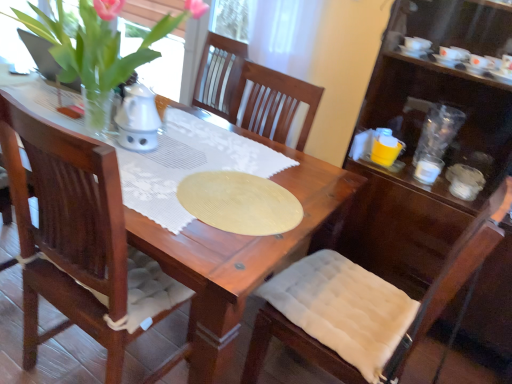
Question: Is transparent plastic cups at right, positioned as the 1th tableware in top-to-bottom order, to the left or to the right of white fabric cushion at lower right in the image?

Choices:
 (A) left
 (B) right

Answer: (B)

Question: From the image's perspective, is transparent plastic cups at right, positioned as the 1th tableware in top-to-bottom order, positioned above or below white fabric cushion at lower right?

Choices:
 (A) below
 (B) above

Answer: (B)

Question: Estimate the real-world distances between objects in this image. Which object is farther from the white glossy cup at right, marked as the first tableware in a bottom-to-top arrangement?

Choices:
 (A) green leafy plant at upper left
 (B) transparent plastic cups at right, marked as the second tableware in a bottom-to-top arrangement
 (C) white fabric cushion at lower right

Answer: (A)

Question: Estimate the real-world distances between objects in this image. Which object is farther from the transparent plastic cups at right, positioned as the 1th tableware in top-to-bottom order?

Choices:
 (A) white glossy cup at right, the second tableware viewed from the top
 (B) green leafy plant at upper left
 (C) white fabric cushion at lower right

Answer: (B)